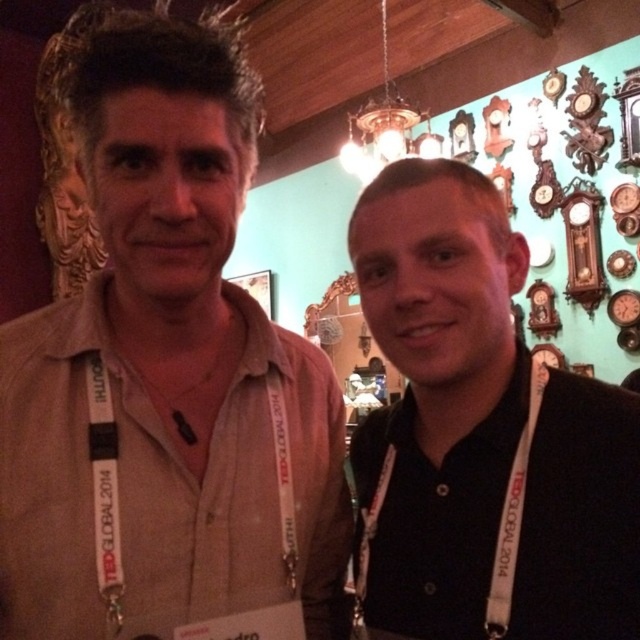
Between beige cotton shirt at center and white fabric lanyard at right, which one appears on the right side from the viewer's perspective?

Positioned to the right is white fabric lanyard at right.

Does beige cotton shirt at center have a smaller size compared to white fabric lanyard at right?

Incorrect, beige cotton shirt at center is not smaller in size than white fabric lanyard at right.

Measure the distance between beige cotton shirt at center and camera.

They are 27.54 inches apart.

Find the location of a particular element. The height and width of the screenshot is (640, 640). beige cotton shirt at center is located at coordinates (166, 376).

Which of these two, black matte shirt at right or white fabric lanyard at right, stands shorter?

white fabric lanyard at right is shorter.

Is black matte shirt at right positioned before white fabric lanyard at right?

Yes, black matte shirt at right is in front of white fabric lanyard at right.

You are a GUI agent. You are given a task and a screenshot of the screen. Output one action in this format:
    pyautogui.click(x=<x>, y=<y>)
    Task: Click on the black matte shirt at right
    
    Given the screenshot: What is the action you would take?
    pyautogui.click(x=481, y=436)

I want to click on black matte shirt at right, so click(x=481, y=436).

Is beige cotton shirt at center smaller than black matte shirt at right?

No.

Locate an element on the screen. The image size is (640, 640). beige cotton shirt at center is located at coordinates (166, 376).